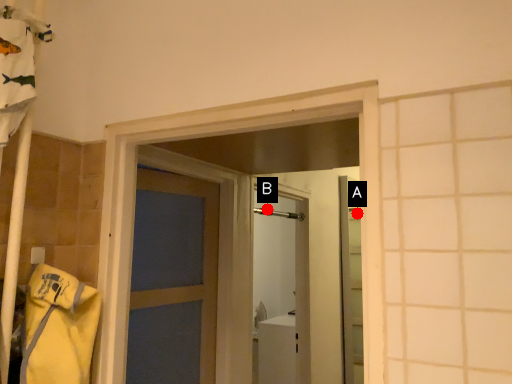
Question: Two points are circled on the image, labeled by A and B beside each circle. Which point is further to the camera?

Choices:
 (A) A is further
 (B) B is further

Answer: (A)